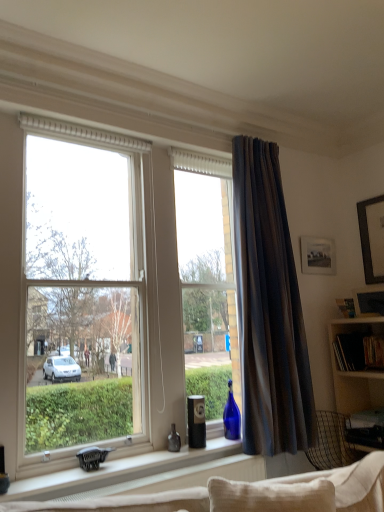
Locate an element on the screen. free space in front of matte glass bottle at window sill is located at coordinates (163, 456).